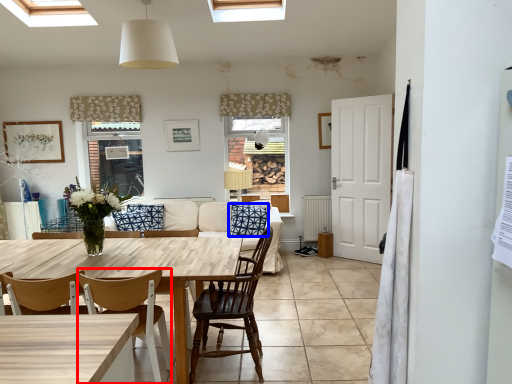
Question: Which of the following is the closest to the observer, chair (highlighted by a red box) or pillow (highlighted by a blue box)?

Choices:
 (A) chair
 (B) pillow

Answer: (A)